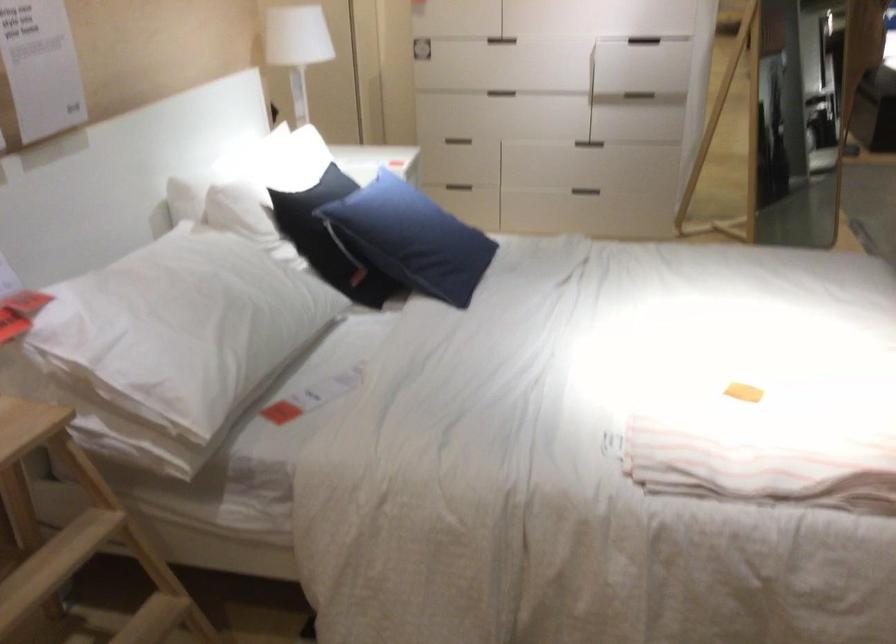
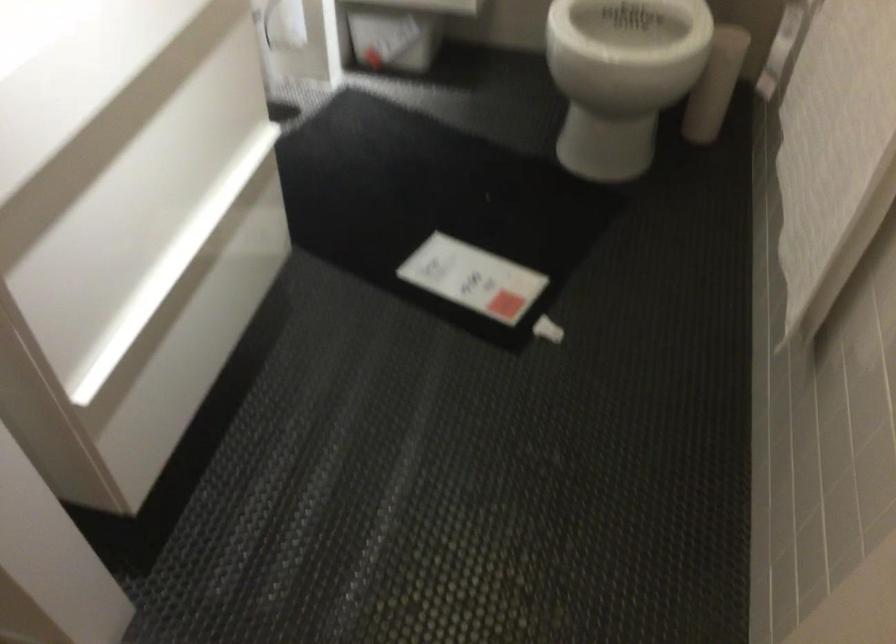
In a continuous first-person perspective shot, in which direction is the camera moving?

The cameraman walked toward left, forward.